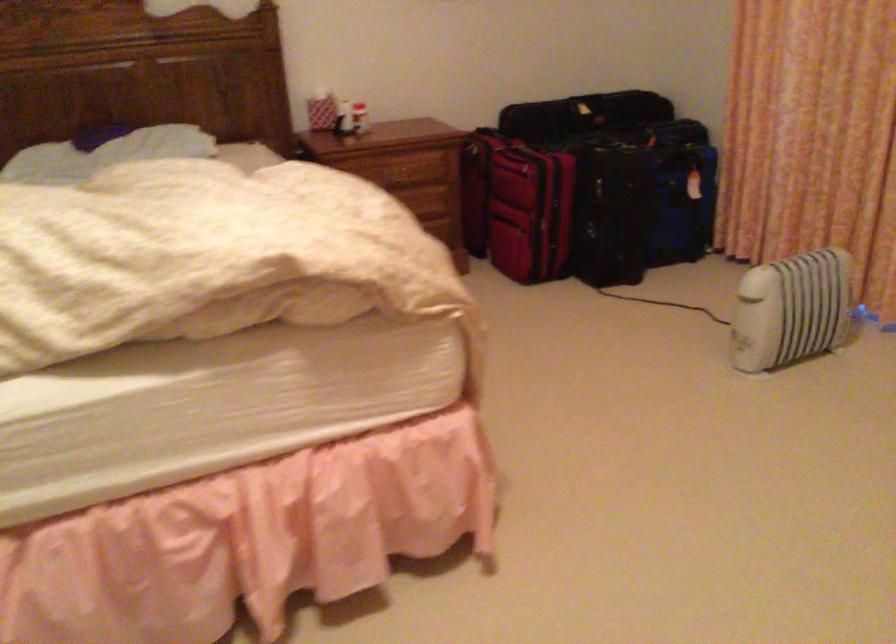
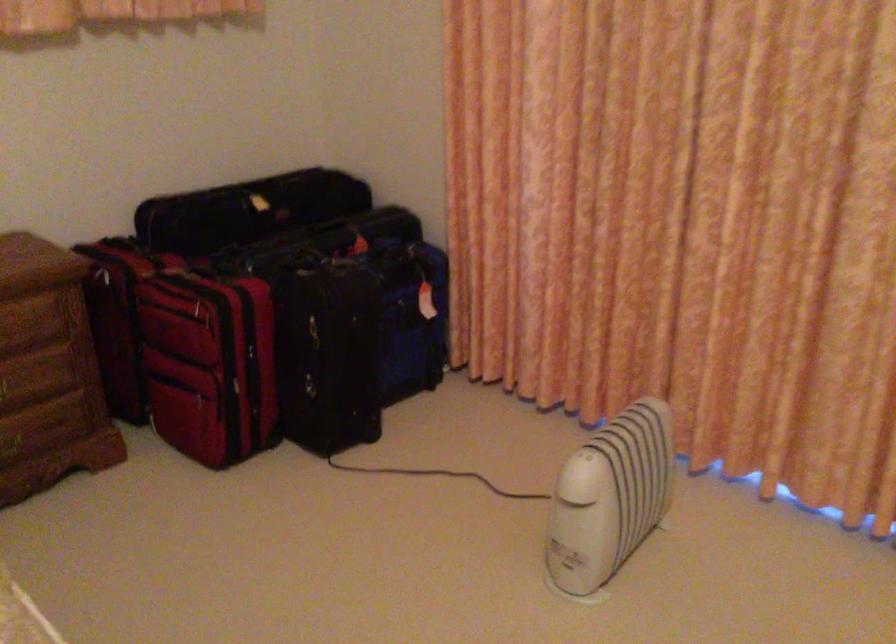
The point at (768,297) is marked in the first image. Where is the corresponding point in the second image?

(609, 498)